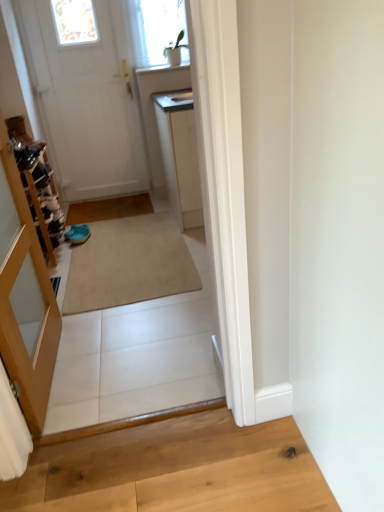
Question: Is there a large distance between light brown wood at lower right and white matte door at upper left?

Choices:
 (A) no
 (B) yes

Answer: (B)

Question: Is light brown wood at lower right facing away from white matte door at upper left?

Choices:
 (A) no
 (B) yes

Answer: (A)

Question: From the image's perspective, does light brown wood at lower right appear lower than white matte door at upper left?

Choices:
 (A) no
 (B) yes

Answer: (B)

Question: Could you tell me if light brown wood at lower right is turned towards white matte door at upper left?

Choices:
 (A) yes
 (B) no

Answer: (B)

Question: Does light brown wood at lower right have a greater width compared to white matte door at upper left?

Choices:
 (A) yes
 (B) no

Answer: (A)

Question: Is light brown wood at lower right thinner than white matte door at upper left?

Choices:
 (A) yes
 (B) no

Answer: (B)

Question: Considering the relative sizes of beige carpet at center and white matte door at upper left in the image provided, is beige carpet at center smaller than white matte door at upper left?

Choices:
 (A) yes
 (B) no

Answer: (B)

Question: Is beige carpet at center in contact with white matte door at upper left?

Choices:
 (A) yes
 (B) no

Answer: (B)

Question: Can you confirm if beige carpet at center is taller than white matte door at upper left?

Choices:
 (A) yes
 (B) no

Answer: (B)

Question: Is beige carpet at center bigger than white matte door at upper left?

Choices:
 (A) no
 (B) yes

Answer: (B)

Question: From the image's perspective, is beige carpet at center below white matte door at upper left?

Choices:
 (A) no
 (B) yes

Answer: (B)

Question: Is beige carpet at center at the left side of white matte door at upper left?

Choices:
 (A) yes
 (B) no

Answer: (B)

Question: From the image's perspective, is white matte door at upper left on beige carpet at center?

Choices:
 (A) yes
 (B) no

Answer: (A)